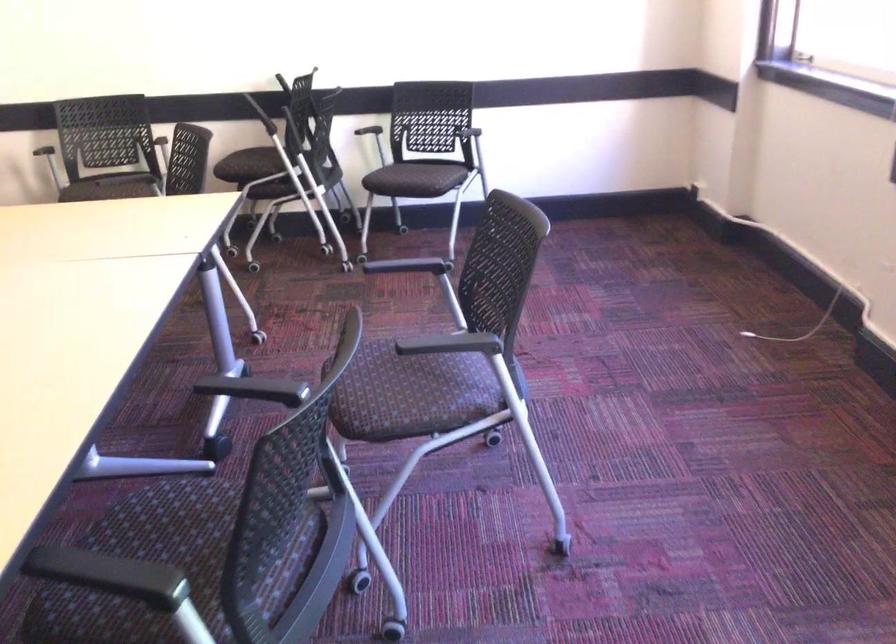
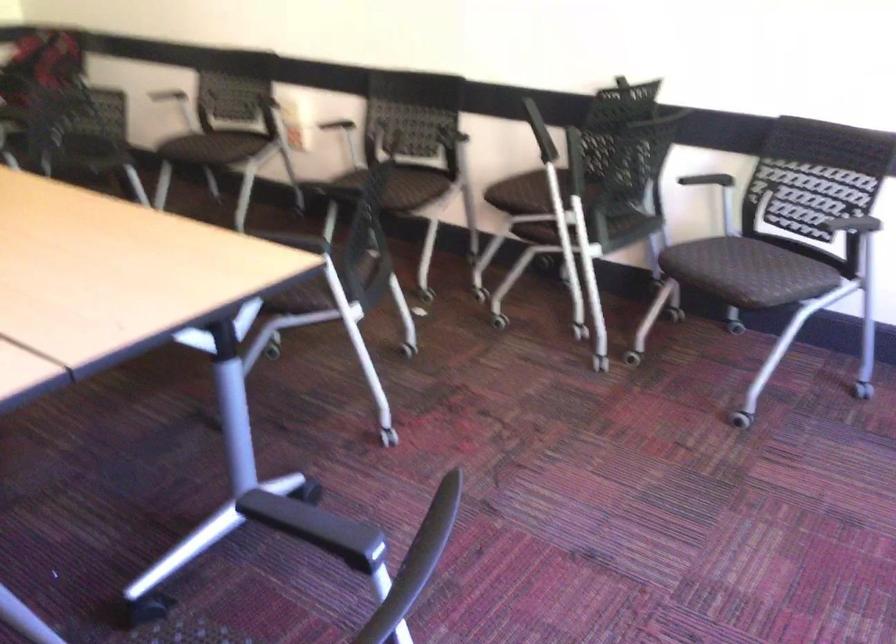
In the second image, find the point that corresponds to point 389,270 in the first image.

(294, 518)